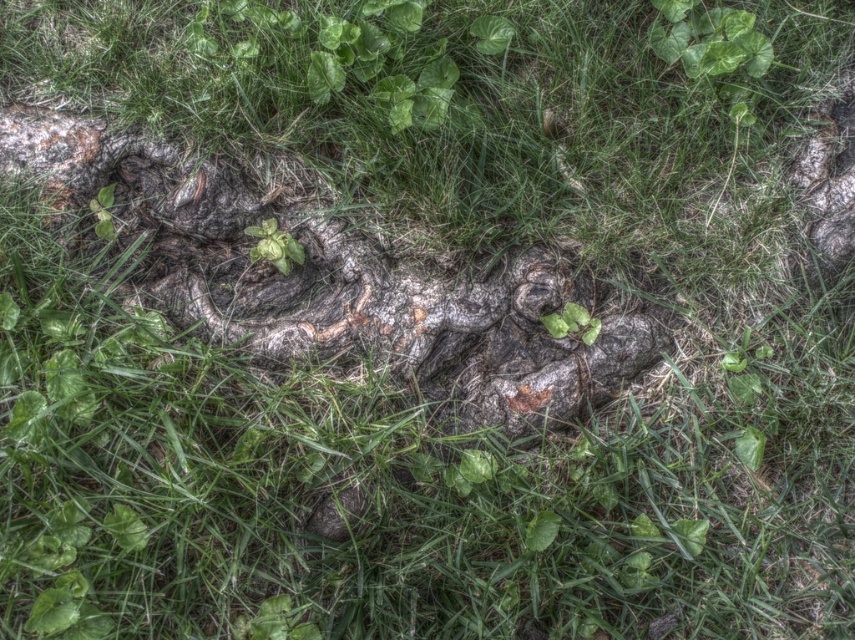
Question: Which of the following is the closest to the observer?

Choices:
 (A) green matte leaf at upper center
 (B) green matte plant at center

Answer: (A)

Question: From the image, what is the correct spatial relationship of green matte leaf at upper center in relation to green matte plant at center?

Choices:
 (A) left
 (B) right

Answer: (B)

Question: From the image, what is the correct spatial relationship of green matte leaf at upper center in relation to green matte plant at center?

Choices:
 (A) left
 (B) right

Answer: (B)

Question: Is green matte leaf at upper center positioned behind green matte plant at center?

Choices:
 (A) no
 (B) yes

Answer: (A)